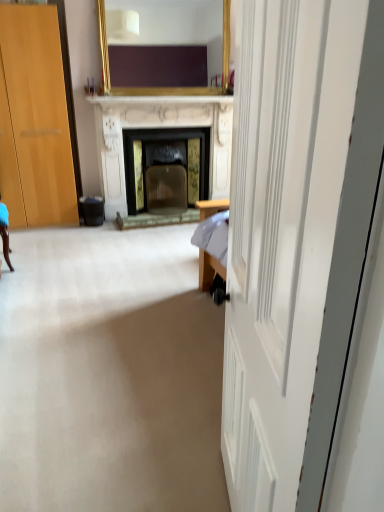
Question: From the image's perspective, does gold-framed mirror at upper center appear lower than white wooden door at center?

Choices:
 (A) yes
 (B) no

Answer: (B)

Question: Could you tell me if gold-framed mirror at upper center is turned towards white wooden door at center?

Choices:
 (A) yes
 (B) no

Answer: (A)

Question: From the image's perspective, is gold-framed mirror at upper center located above white wooden door at center?

Choices:
 (A) no
 (B) yes

Answer: (B)

Question: Is gold-framed mirror at upper center not within white wooden door at center?

Choices:
 (A) yes
 (B) no

Answer: (A)

Question: Does gold-framed mirror at upper center have a lesser height compared to white wooden door at center?

Choices:
 (A) yes
 (B) no

Answer: (A)

Question: Is gold-framed mirror at upper center thinner than white wooden door at center?

Choices:
 (A) no
 (B) yes

Answer: (B)

Question: Could you tell me if black plastic trash bin at lower left is facing white wooden door at center?

Choices:
 (A) yes
 (B) no

Answer: (B)

Question: Is black plastic trash bin at lower left touching white wooden door at center?

Choices:
 (A) yes
 (B) no

Answer: (B)

Question: Is black plastic trash bin at lower left facing away from white wooden door at center?

Choices:
 (A) no
 (B) yes

Answer: (A)

Question: Considering the relative sizes of black plastic trash bin at lower left and white wooden door at center in the image provided, is black plastic trash bin at lower left smaller than white wooden door at center?

Choices:
 (A) no
 (B) yes

Answer: (B)

Question: From a real-world perspective, is black plastic trash bin at lower left positioned under white wooden door at center based on gravity?

Choices:
 (A) no
 (B) yes

Answer: (B)

Question: Could white wooden door at center be considered to be inside black plastic trash bin at lower left?

Choices:
 (A) no
 (B) yes

Answer: (A)

Question: Does black plastic trash bin at lower left come behind gold-framed mirror at upper center?

Choices:
 (A) no
 (B) yes

Answer: (B)